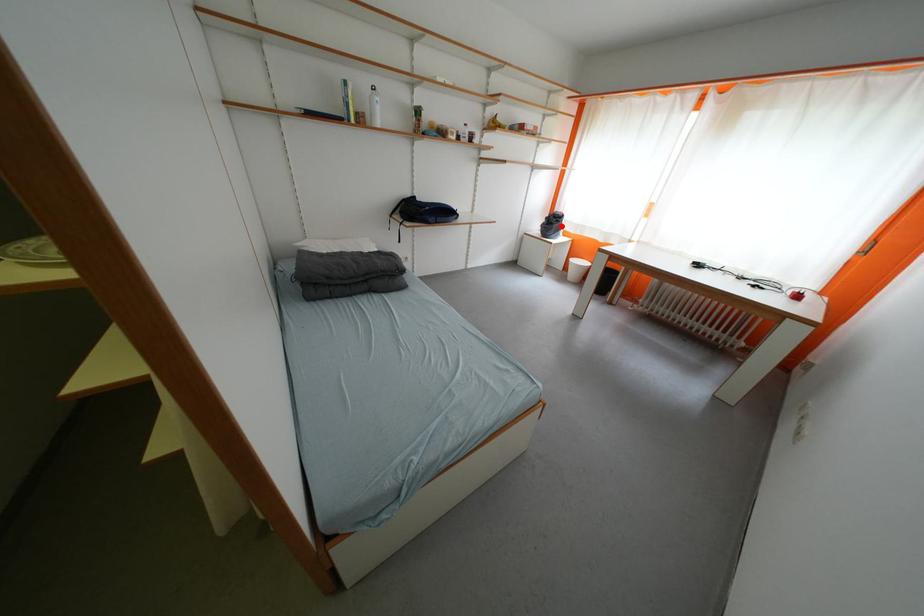
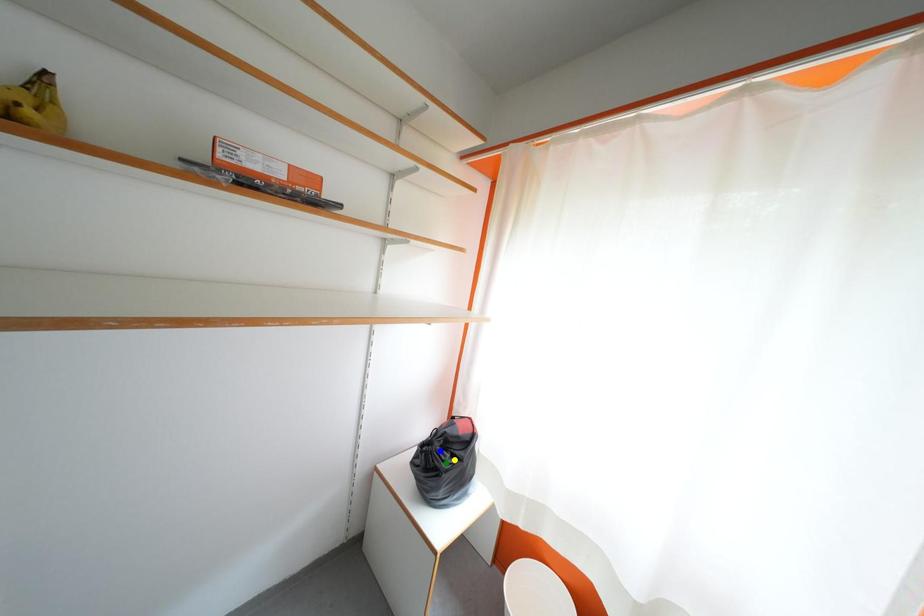
Question: I am providing you with two images of the same scene from different viewpoints. A red point is marked on the first image. You are given multiple points on the second image. Can you choose the point in image 2 that corresponds to the point in image 1?

Choices:
 (A) blue point
 (B) green point
 (C) yellow point

Answer: (C)